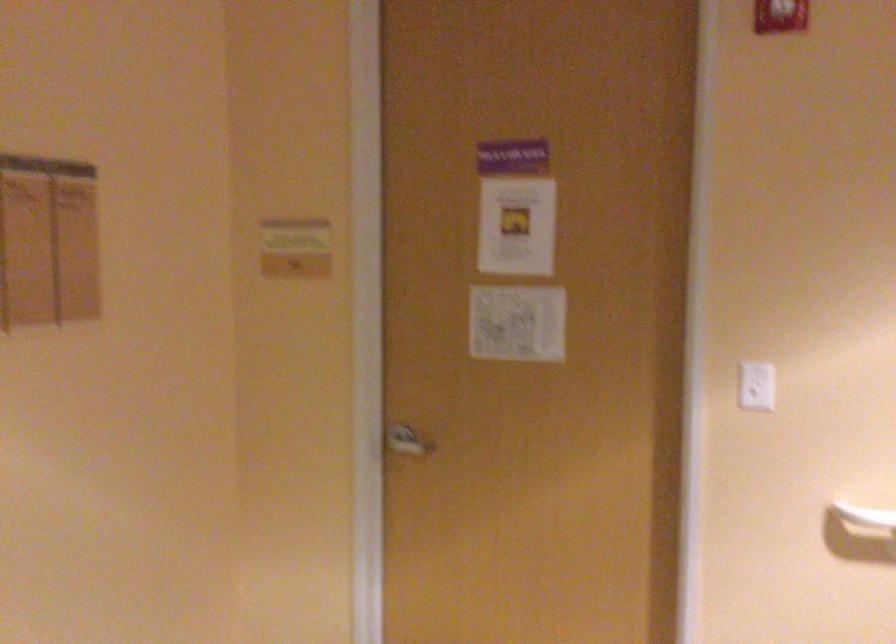
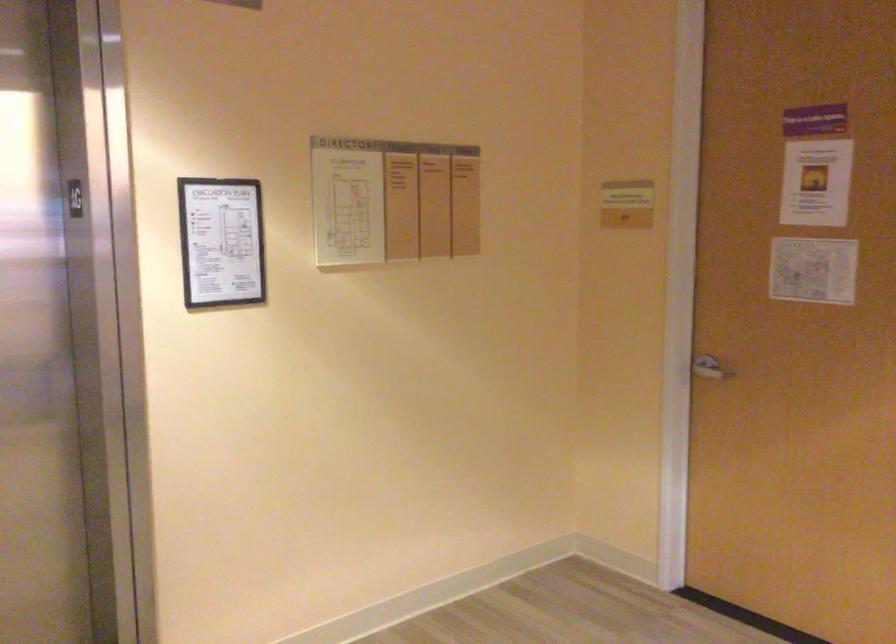
Question: The camera is either moving clockwise (left) or counter-clockwise (right) around the object. The first image is from the beginning of the video and the second image is from the end. Is the camera moving left or right when shooting the video?

Choices:
 (A) Left
 (B) Right

Answer: (B)